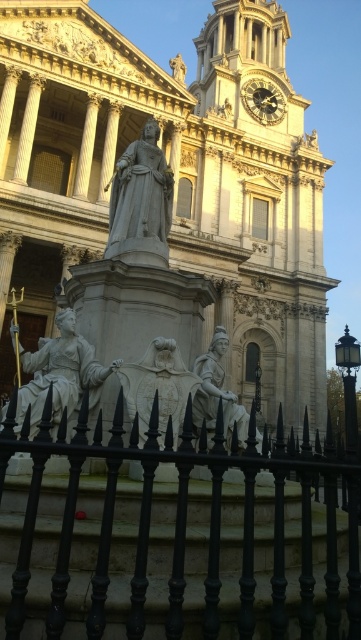
Measure the distance between white stone church at center and camera.

white stone church at center and camera are 125.81 feet apart.

Who is shorter, white stone church at center or polished bronze statue at center?

polished bronze statue at center

Is point (32, 29) farther from camera compared to point (237, 400)?

Yes, point (32, 29) is behind point (237, 400).

You are a GUI agent. You are given a task and a screenshot of the screen. Output one action in this format:
    pyautogui.click(x=<x>, y=<y>)
    Task: Click on the white stone church at center
    
    Given the screenshot: What is the action you would take?
    pyautogui.click(x=174, y=179)

Can you confirm if white stone church at center is shorter than gold metallic clock at upper center?

No.

In the scene shown: Which of these two, white stone church at center or gold metallic clock at upper center, stands taller?

white stone church at center

This screenshot has height=640, width=361. Identify the location of white stone church at center. (174, 179).

Can you confirm if black wrought iron fence at lower center is shorter than gray stone statue at center?

Incorrect, black wrought iron fence at lower center's height does not fall short of gray stone statue at center's.

Can you confirm if black wrought iron fence at lower center is taller than gray stone statue at center?

Yes.

Is point (337, 486) farther from viewer compared to point (127, 172)?

Yes, point (337, 486) is behind point (127, 172).

Find the location of a particular element. This screenshot has width=361, height=640. black wrought iron fence at lower center is located at coordinates (185, 522).